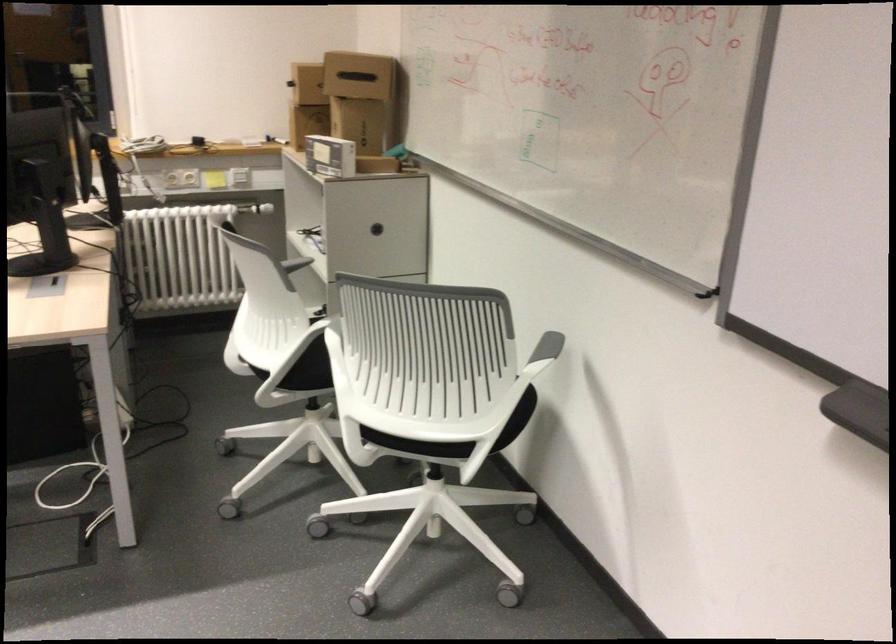
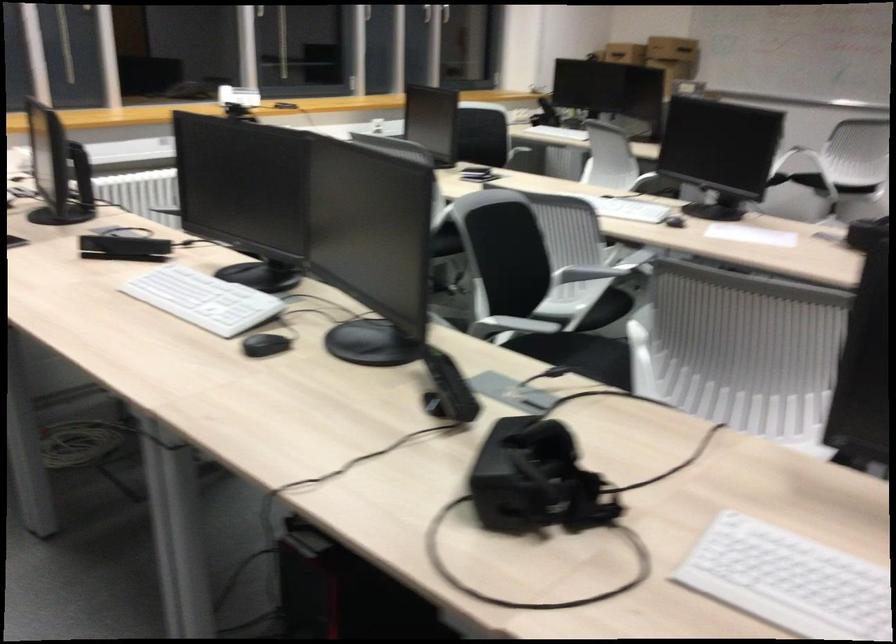
Question: I am providing you with two images of the same scene from different viewpoints. Please identify which objects are invisible in image2.

Choices:
 (A) black digital scale
 (B) cardboard box
 (C) chair armrest
 (D) telephone handset

Answer: (B)